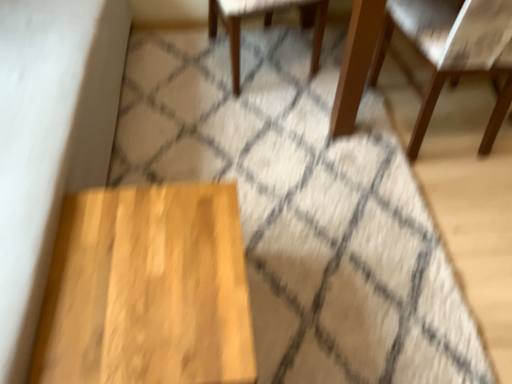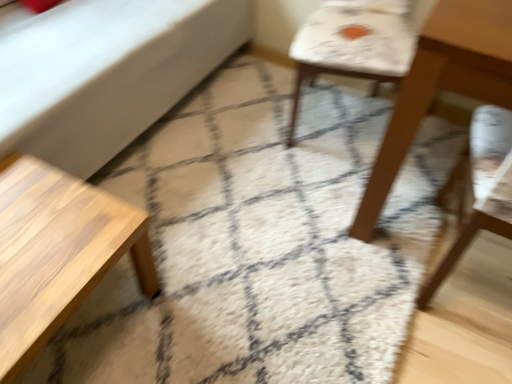
Question: Which way did the camera rotate in the video?

Choices:
 (A) rotated downward
 (B) rotated upward

Answer: (B)